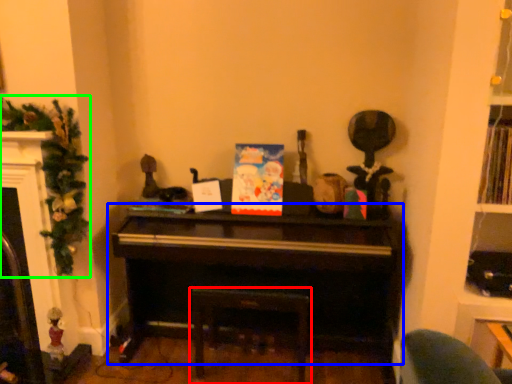
Question: Which is farther away from furniture (highlighted by a red box)? piano (highlighted by a blue box) or christmas decoration (highlighted by a green box)?

Choices:
 (A) piano
 (B) christmas decoration

Answer: (B)